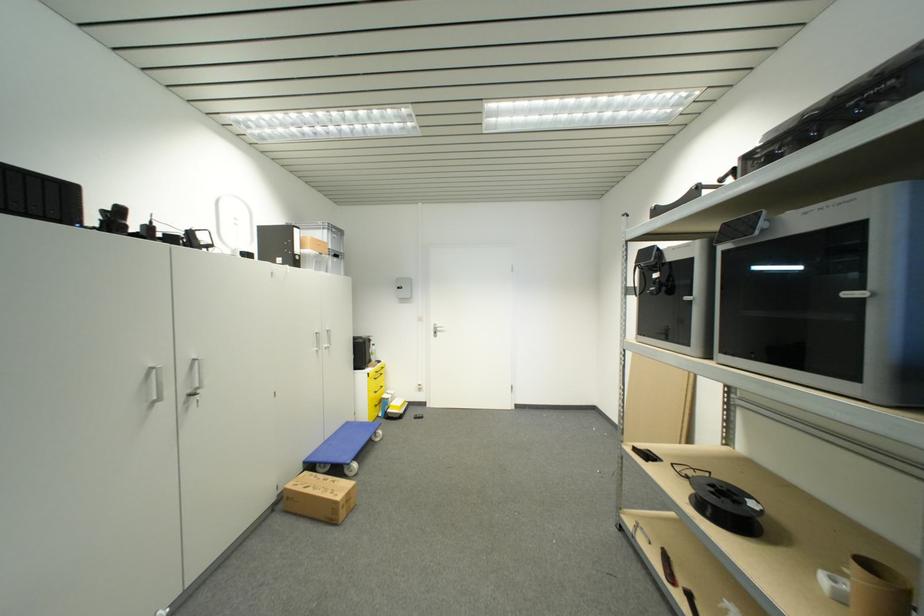
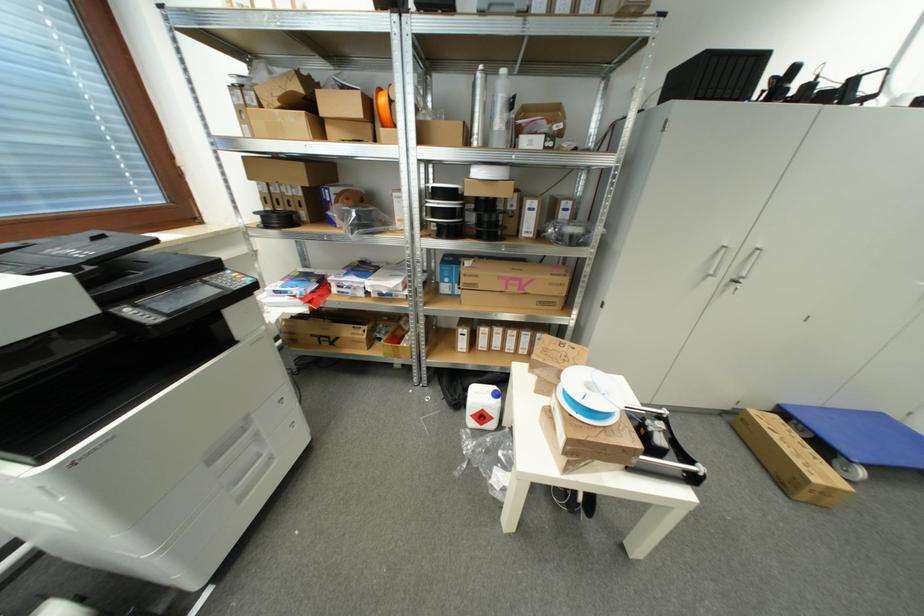
Based on the continuous images, in which direction is the camera rotating?

The rotation direction of the camera is left-down.